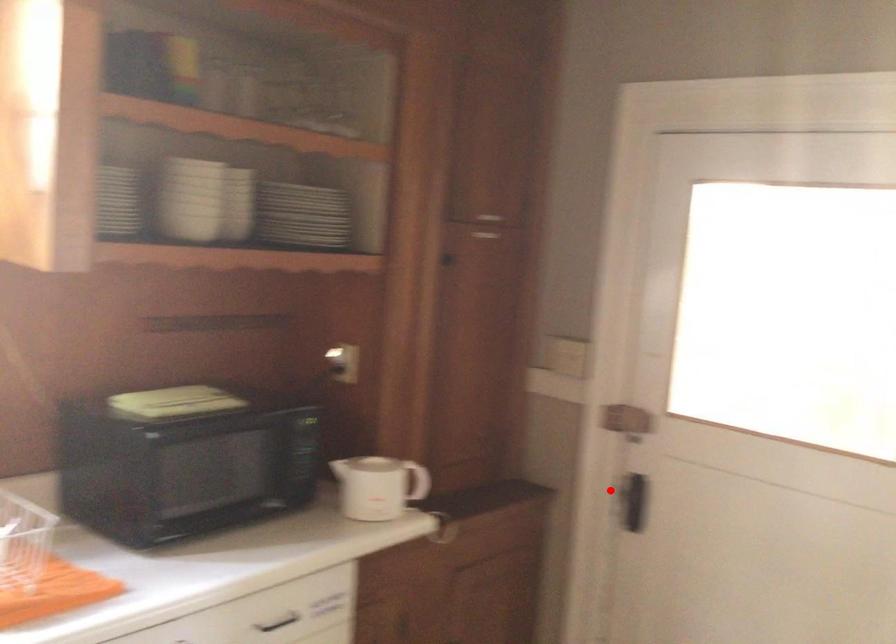
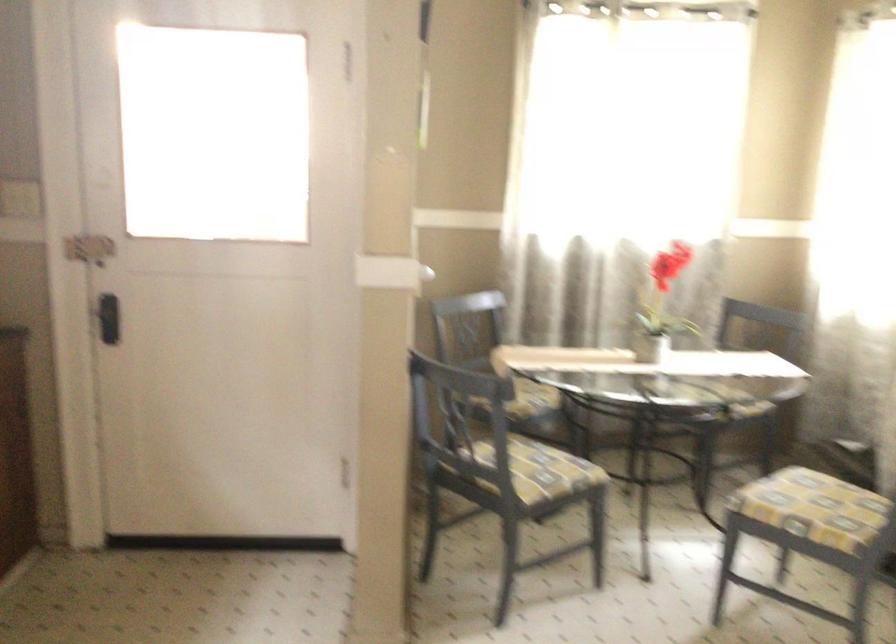
In the second image, find the point that corresponds to the highlighted location in the first image.

(108, 317)